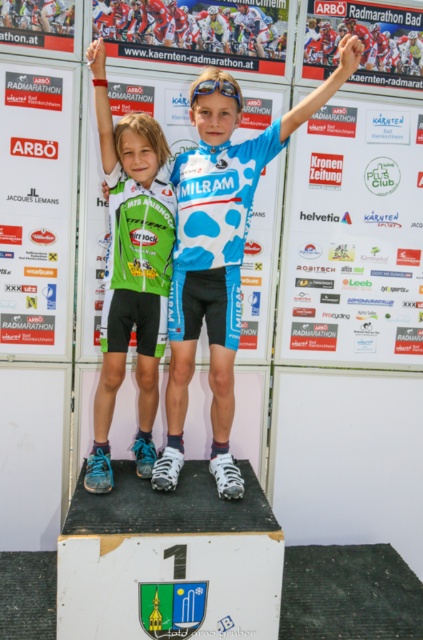
Can you confirm if matte blue jersey at center is positioned below green matte jersey at center?

Indeed, matte blue jersey at center is positioned under green matte jersey at center.

Between point (230, 291) and point (159, 195), which one is positioned in front?

Point (159, 195)

Where is `matte blue jersey at center`? This screenshot has width=423, height=640. matte blue jersey at center is located at coordinates (219, 253).